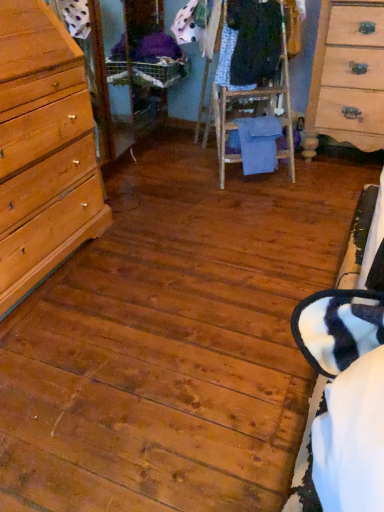
How much space does dark blue fabric at center, which is counted as the 3th clothing, starting from the bottom, occupy horizontally?

dark blue fabric at center, which is counted as the 3th clothing, starting from the bottom, is 19.77 inches in width.

At what (x,y) coordinates should I click in order to perform the action: click on light wood/finish dresser at right. Please return your answer as a coordinate pair (x, y). The height and width of the screenshot is (512, 384). Looking at the image, I should click on (347, 77).

Describe the element at coordinates (256, 143) in the screenshot. I see `blue cotton towel at center, the 1th clothing from the bottom` at that location.

Locate an element on the screen. Image resolution: width=384 pixels, height=512 pixels. dark blue fabric at center, the 1th clothing in the top-to-bottom sequence is located at coordinates (254, 41).

From the image's perspective, who appears lower, dark blue fabric at center, which is counted as the 3th clothing, starting from the bottom, or light wood/finish dresser at right?

light wood/finish dresser at right appears lower in the image.

Where is `clothing in front of the light wood/finish dresser at right`? clothing in front of the light wood/finish dresser at right is located at coordinates (254, 41).

Between dark blue fabric at center, which is counted as the 3th clothing, starting from the bottom, and light wood/finish dresser at right, which one has less height?

dark blue fabric at center, which is counted as the 3th clothing, starting from the bottom.

From a real-world perspective, does dark blue fabric at center, the 1th clothing in the top-to-bottom sequence, stand above light wood/finish dresser at right?

Yes, from a real-world perspective, dark blue fabric at center, the 1th clothing in the top-to-bottom sequence, is on top of light wood/finish dresser at right.

Looking at the image, does patterned fabric dress at center, marked as the 2th clothing in a top-to-bottom arrangement, seem bigger or smaller compared to dark blue fabric at center, which is counted as the 3th clothing, starting from the bottom?

patterned fabric dress at center, marked as the 2th clothing in a top-to-bottom arrangement, is smaller than dark blue fabric at center, which is counted as the 3th clothing, starting from the bottom.

Where is `clothing that is on the left side of dark blue fabric at center, which is counted as the 3th clothing, starting from the bottom`? clothing that is on the left side of dark blue fabric at center, which is counted as the 3th clothing, starting from the bottom is located at coordinates (228, 61).

Would you say patterned fabric dress at center, the 2th clothing in the bottom-to-top sequence, contains dark blue fabric at center, the 1th clothing in the top-to-bottom sequence?

No, patterned fabric dress at center, the 2th clothing in the bottom-to-top sequence, does not contain dark blue fabric at center, the 1th clothing in the top-to-bottom sequence.

Is patterned fabric dress at center, marked as the 2th clothing in a top-to-bottom arrangement, facing towards dark blue fabric at center, the 1th clothing in the top-to-bottom sequence?

Yes.

From a real-world perspective, is light wood/finish dresser at right on blue cotton towel at center, the 1th clothing from the bottom?

Indeed, from a real-world perspective, light wood/finish dresser at right stands above blue cotton towel at center, the 1th clothing from the bottom.

Where is `the chest of drawers in front of the blue cotton towel at center, marked as the third clothing in a top-to-bottom arrangement`? Image resolution: width=384 pixels, height=512 pixels. the chest of drawers in front of the blue cotton towel at center, marked as the third clothing in a top-to-bottom arrangement is located at coordinates (347, 77).

Considering the relative sizes of light wood/finish dresser at right and blue cotton towel at center, the 1th clothing from the bottom, in the image provided, is light wood/finish dresser at right bigger than blue cotton towel at center, the 1th clothing from the bottom,?

Indeed, light wood/finish dresser at right has a larger size compared to blue cotton towel at center, the 1th clothing from the bottom.

From the image's perspective, is light wood/finish dresser at right over dark blue fabric at center, the 1th clothing in the top-to-bottom sequence?

No, from the image's perspective, light wood/finish dresser at right is not above dark blue fabric at center, the 1th clothing in the top-to-bottom sequence.

Can you confirm if light wood/finish dresser at right is smaller than dark blue fabric at center, which is counted as the 3th clothing, starting from the bottom?

Actually, light wood/finish dresser at right might be larger than dark blue fabric at center, which is counted as the 3th clothing, starting from the bottom.

From a real-world perspective, is light wood/finish dresser at right above or below dark blue fabric at center, which is counted as the 3th clothing, starting from the bottom?

light wood/finish dresser at right is situated lower than dark blue fabric at center, which is counted as the 3th clothing, starting from the bottom, in the real world.

Is light wood/finish dresser at right situated inside dark blue fabric at center, which is counted as the 3th clothing, starting from the bottom, or outside?

light wood/finish dresser at right is outside dark blue fabric at center, which is counted as the 3th clothing, starting from the bottom.

Where is `the chest of drawers lying above the blue cotton towel at center, marked as the third clothing in a top-to-bottom arrangement (from the image's perspective)`? This screenshot has width=384, height=512. the chest of drawers lying above the blue cotton towel at center, marked as the third clothing in a top-to-bottom arrangement (from the image's perspective) is located at coordinates (347, 77).

Considering the sizes of blue cotton towel at center, the 1th clothing from the bottom, and light wood/finish dresser at right in the image, is blue cotton towel at center, the 1th clothing from the bottom, wider or thinner than light wood/finish dresser at right?

In the image, blue cotton towel at center, the 1th clothing from the bottom, appears to be more narrow than light wood/finish dresser at right.

From the picture: Is blue cotton towel at center, marked as the third clothing in a top-to-bottom arrangement, turned away from light wood/finish dresser at right?

No, blue cotton towel at center, marked as the third clothing in a top-to-bottom arrangement, is not facing away from light wood/finish dresser at right.

From the image's perspective, is blue cotton towel at center, the 1th clothing from the bottom, on top of light wood/finish dresser at right?

No.

Is point (263, 142) farther from viewer compared to point (229, 84)?

Yes, it is.

From a real-world perspective, is blue cotton towel at center, marked as the third clothing in a top-to-bottom arrangement, under patterned fabric dress at center, marked as the 2th clothing in a top-to-bottom arrangement?

Yes, from a real-world perspective, blue cotton towel at center, marked as the third clothing in a top-to-bottom arrangement, is under patterned fabric dress at center, marked as the 2th clothing in a top-to-bottom arrangement.

Is blue cotton towel at center, marked as the third clothing in a top-to-bottom arrangement, completely or partially outside of patterned fabric dress at center, marked as the 2th clothing in a top-to-bottom arrangement?

Yes, blue cotton towel at center, marked as the third clothing in a top-to-bottom arrangement, is not within patterned fabric dress at center, marked as the 2th clothing in a top-to-bottom arrangement.

In the scene shown: Does blue cotton towel at center, marked as the third clothing in a top-to-bottom arrangement, appear on the right side of patterned fabric dress at center, the 2th clothing in the bottom-to-top sequence?

Indeed, blue cotton towel at center, marked as the third clothing in a top-to-bottom arrangement, is positioned on the right side of patterned fabric dress at center, the 2th clothing in the bottom-to-top sequence.

Considering the relative positions of blue cotton towel at center, the 1th clothing from the bottom, and dark blue fabric at center, the 1th clothing in the top-to-bottom sequence, in the image provided, is blue cotton towel at center, the 1th clothing from the bottom, to the left of dark blue fabric at center, the 1th clothing in the top-to-bottom sequence, from the viewer's perspective?

In fact, blue cotton towel at center, the 1th clothing from the bottom, is to the right of dark blue fabric at center, the 1th clothing in the top-to-bottom sequence.

Which object is wider, blue cotton towel at center, the 1th clothing from the bottom, or dark blue fabric at center, the 1th clothing in the top-to-bottom sequence?

dark blue fabric at center, the 1th clothing in the top-to-bottom sequence.

Which is less distant, (279,128) or (238,51)?

Clearly, point (279,128) is more distant from the camera than point (238,51).

Is blue cotton towel at center, marked as the third clothing in a top-to-bottom arrangement, outside of dark blue fabric at center, the 1th clothing in the top-to-bottom sequence?

That's correct, blue cotton towel at center, marked as the third clothing in a top-to-bottom arrangement, is outside of dark blue fabric at center, the 1th clothing in the top-to-bottom sequence.

You are a GUI agent. You are given a task and a screenshot of the screen. Output one action in this format:
    pyautogui.click(x=<x>, y=<y>)
    Task: Click on the 2nd clothing directly above the light wood/finish dresser at right (from a real-world perspective)
    
    Given the screenshot: What is the action you would take?
    pyautogui.click(x=254, y=41)

The height and width of the screenshot is (512, 384). Identify the location of clothing that is the 1st one below the dark blue fabric at center, which is counted as the 3th clothing, starting from the bottom (from a real-world perspective). (228, 61).

From the image, which object appears to be farther from blue cotton towel at center, marked as the third clothing in a top-to-bottom arrangement, light wood/finish dresser at right or patterned fabric dress at center, the 2th clothing in the bottom-to-top sequence?

Among the two, light wood/finish dresser at right is located further to blue cotton towel at center, marked as the third clothing in a top-to-bottom arrangement.

When comparing their distances from blue cotton towel at center, the 1th clothing from the bottom, does dark blue fabric at center, the 1th clothing in the top-to-bottom sequence, or light wood/finish dresser at right seem further?

light wood/finish dresser at right.

Estimate the real-world distances between objects in this image. Which object is further from patterned fabric dress at center, the 2th clothing in the bottom-to-top sequence, blue cotton towel at center, marked as the third clothing in a top-to-bottom arrangement, or dark blue fabric at center, the 1th clothing in the top-to-bottom sequence?

blue cotton towel at center, marked as the third clothing in a top-to-bottom arrangement, is further to patterned fabric dress at center, the 2th clothing in the bottom-to-top sequence.

Which object lies nearer to the anchor point dark blue fabric at center, which is counted as the 3th clothing, starting from the bottom, blue cotton towel at center, the 1th clothing from the bottom, or patterned fabric dress at center, the 2th clothing in the bottom-to-top sequence?

patterned fabric dress at center, the 2th clothing in the bottom-to-top sequence, lies closer to dark blue fabric at center, which is counted as the 3th clothing, starting from the bottom, than the other object.

Based on the photo, considering their positions, is patterned fabric dress at center, the 2th clothing in the bottom-to-top sequence, positioned further to light wood/finish dresser at right than dark blue fabric at center, which is counted as the 3th clothing, starting from the bottom?

patterned fabric dress at center, the 2th clothing in the bottom-to-top sequence, is further to light wood/finish dresser at right.

Estimate the real-world distances between objects in this image. Which object is closer to light wood/finish dresser at right, dark blue fabric at center, which is counted as the 3th clothing, starting from the bottom, or patterned fabric dress at center, the 2th clothing in the bottom-to-top sequence?

The object closer to light wood/finish dresser at right is dark blue fabric at center, which is counted as the 3th clothing, starting from the bottom.

Consider the image. Estimate the real-world distances between objects in this image. Which object is further from blue cotton towel at center, the 1th clothing from the bottom, light wood/finish dresser at right or dark blue fabric at center, the 1th clothing in the top-to-bottom sequence?

Among the two, light wood/finish dresser at right is located further to blue cotton towel at center, the 1th clothing from the bottom.

Estimate the real-world distances between objects in this image. Which object is further from blue cotton towel at center, the 1th clothing from the bottom, dark blue fabric at center, the 1th clothing in the top-to-bottom sequence, or patterned fabric dress at center, marked as the 2th clothing in a top-to-bottom arrangement?

dark blue fabric at center, the 1th clothing in the top-to-bottom sequence, lies further to blue cotton towel at center, the 1th clothing from the bottom, than the other object.

Locate an element on the screen. Image resolution: width=384 pixels, height=512 pixels. clothing between dark blue fabric at center, which is counted as the 3th clothing, starting from the bottom, and blue cotton towel at center, marked as the third clothing in a top-to-bottom arrangement, from top to bottom is located at coordinates point(228,61).

Image resolution: width=384 pixels, height=512 pixels. In order to click on clothing between dark blue fabric at center, which is counted as the 3th clothing, starting from the bottom, and light wood/finish dresser at right in this screenshot , I will do `click(256, 143)`.